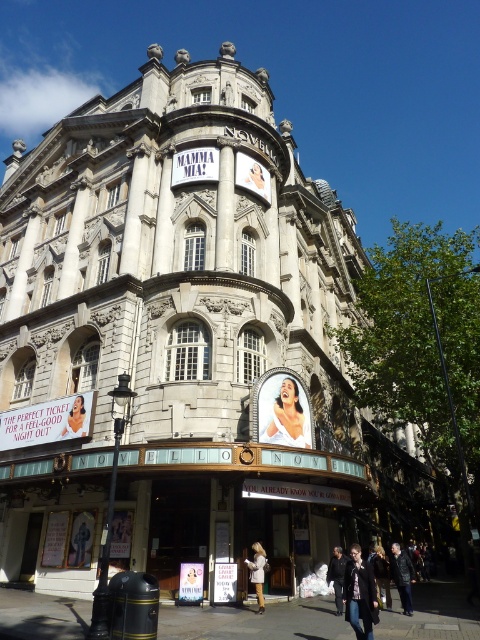
You are a fashion designer visiting the Novello Theatre and see the light brown leather jacket at center and the matte black poster at center. Which object is closer to the ground?

The light brown leather jacket at center is positioned under the matte black poster at center, so it is closer to the ground.

You are a photographer positioned in front of the Novello Theatre. You want to take a photo of the light brown leather jacket at center and the matte black poster at center. Which object will appear closer to the camera in the photo?

The light brown leather jacket at center will appear closer to the camera in the photo because it is in front of the matte black poster at center.